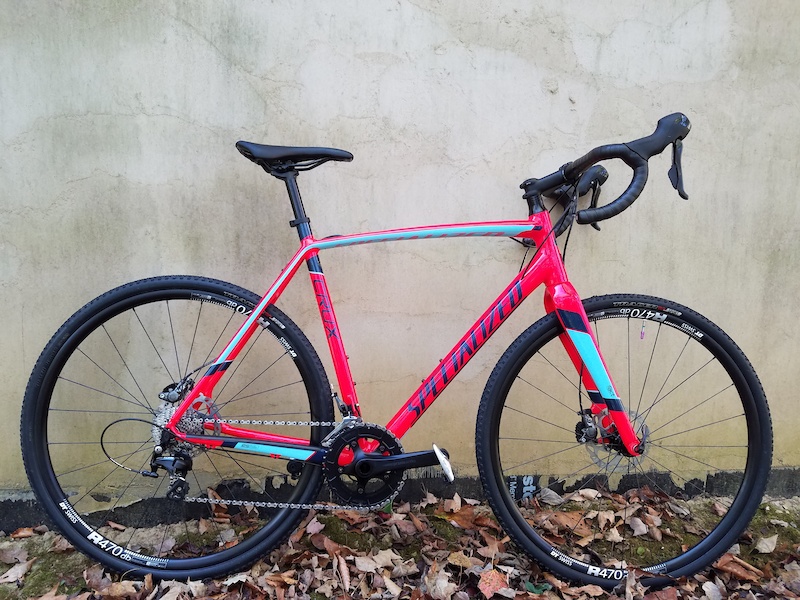
Where is `dark writing on frame`? The image size is (800, 600). dark writing on frame is located at coordinates (464, 356), (324, 313).